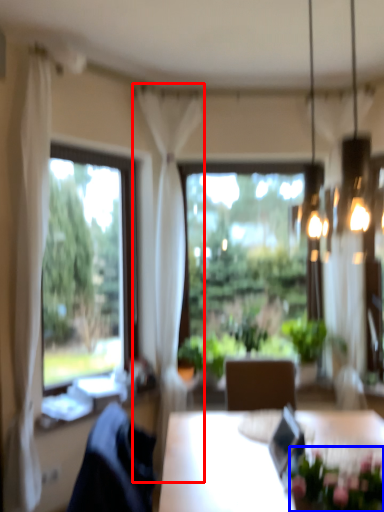
Question: Which of the following is the closest to the observer, curtain (highlighted by a red box) or floral arrangement (highlighted by a blue box)?

Choices:
 (A) curtain
 (B) floral arrangement

Answer: (B)